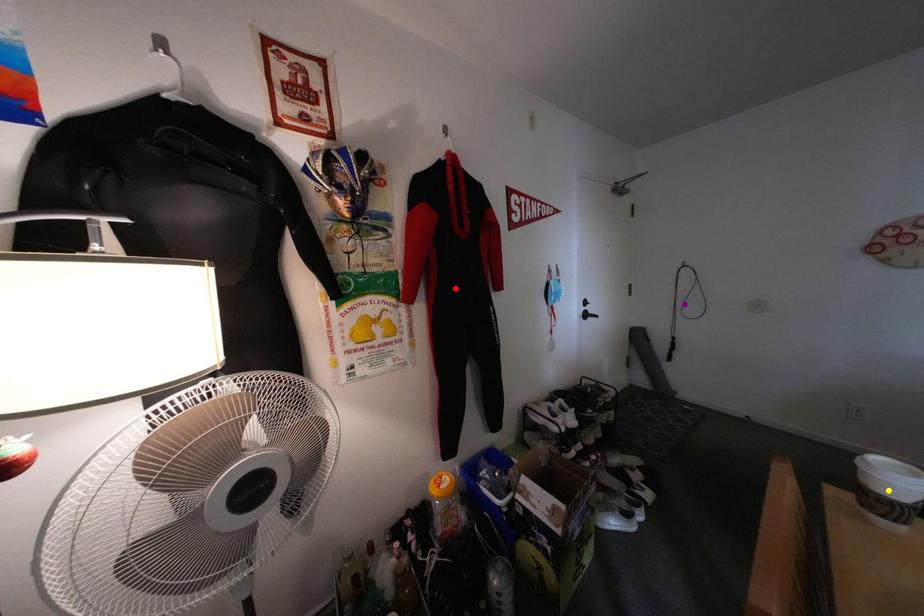
Order these from nearest to farthest:
yellow point, purple point, red point

yellow point → red point → purple point